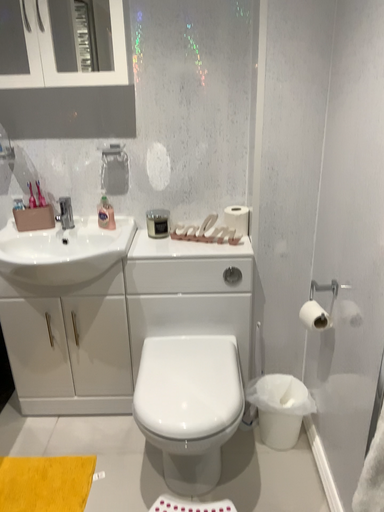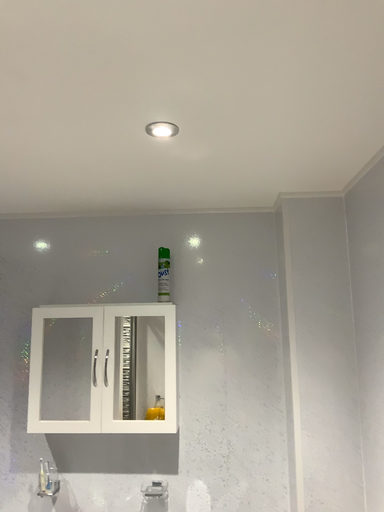
Question: Which way did the camera rotate in the video?

Choices:
 (A) rotated upward
 (B) rotated downward

Answer: (A)